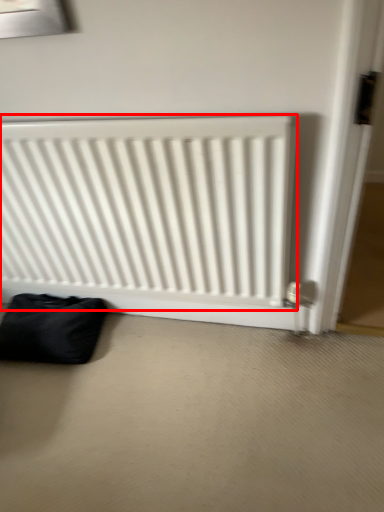
Question: Where is radiator (annotated by the red box) located in relation to furniture in the image?

Choices:
 (A) left
 (B) right

Answer: (B)